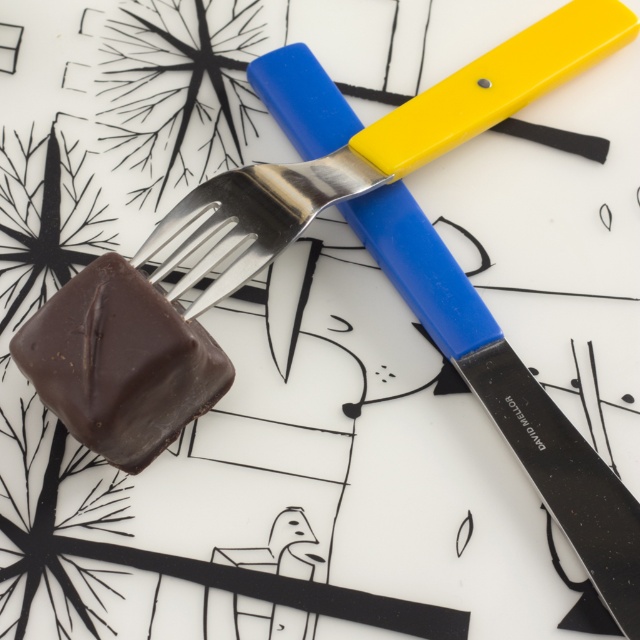
You are setting up a table for a dessert tasting event. You have a shiny metal fork at lower left and a chocolatesmoothchocolate cube at left on the table. To ensure guests can easily access both items, which item is closer to the guests when they approach the table from the front?

The shiny metal fork at lower left is closer to the guests because it is positioned further to the viewer than the chocolatesmoothchocolate cube at left, meaning it would be the first item they encounter as they approach the table from the front.